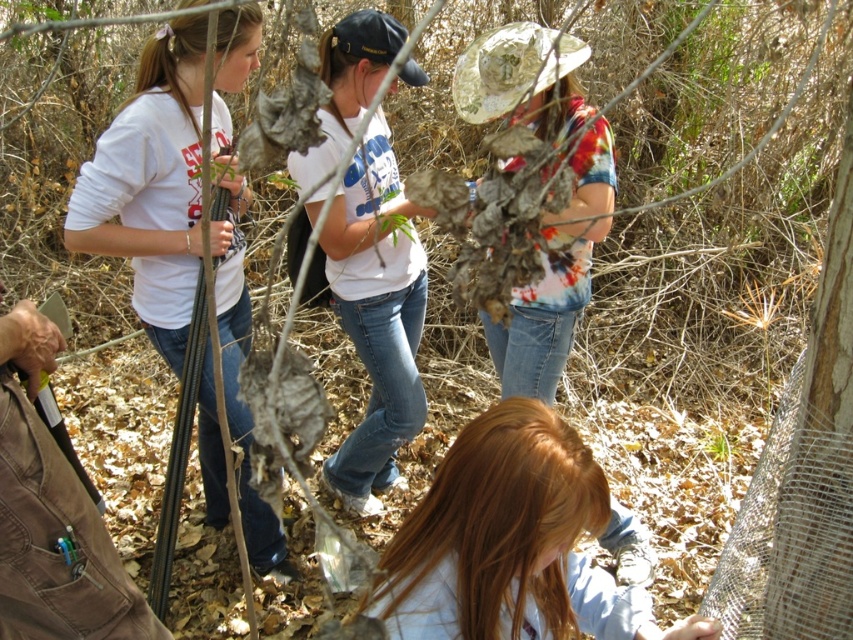
Is light brown hair at lower center bigger than printed cotton shirt at center?

Answer: Incorrect, light brown hair at lower center is not larger than printed cotton shirt at center.

Is point (474, 598) positioned after point (567, 65)?

That is False.

I want to click on light brown hair at lower center, so click(508, 541).

The height and width of the screenshot is (640, 853). I want to click on light brown hair at lower center, so coord(508,541).

Can you confirm if white matte shirt at left is positioned above light brown hair at lower center?

Correct, white matte shirt at left is located above light brown hair at lower center.

I want to click on white matte shirt at left, so click(151, 186).

You are a GUI agent. You are given a task and a screenshot of the screen. Output one action in this format:
    pyautogui.click(x=<x>, y=<y>)
    Task: Click on the white matte shirt at left
    
    Given the screenshot: What is the action you would take?
    pyautogui.click(x=151, y=186)

Can you confirm if white cotton t-shirt at center is bigger than printed cotton shirt at center?

Incorrect, white cotton t-shirt at center is not larger than printed cotton shirt at center.

Is white cotton t-shirt at center closer to camera compared to printed cotton shirt at center?

No, white cotton t-shirt at center is behind printed cotton shirt at center.

Where is `white cotton t-shirt at center`? Image resolution: width=853 pixels, height=640 pixels. white cotton t-shirt at center is located at coordinates (376, 314).